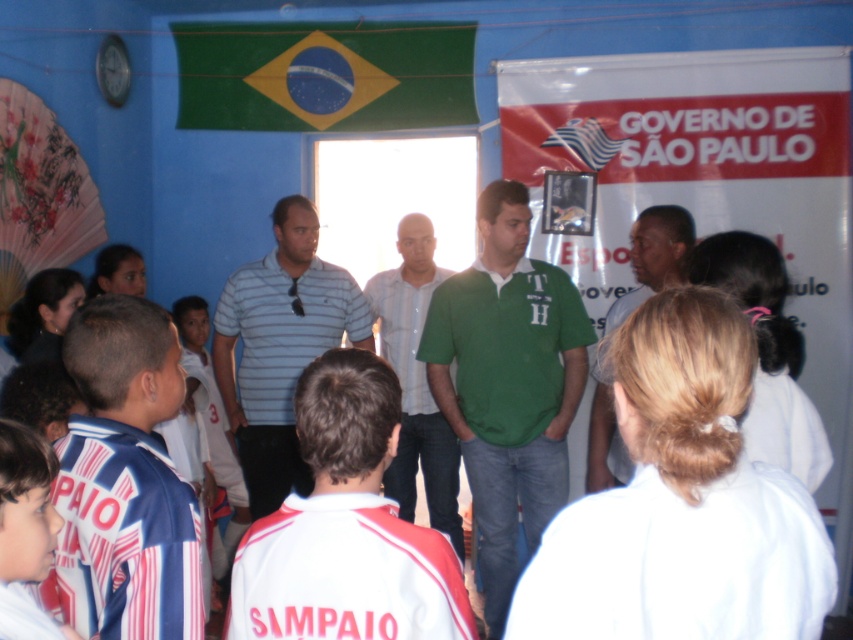
Question: Which point is closer to the camera taking this photo?

Choices:
 (A) (15, 456)
 (B) (743, 257)
 (C) (347, 444)

Answer: (A)

Question: Is the position of blonde hair at upper right less distant than that of light blue striped shirt at center?

Choices:
 (A) no
 (B) yes

Answer: (B)

Question: Which point is farther from the camera taking this photo?

Choices:
 (A) (320, 124)
 (B) (450, 426)

Answer: (A)

Question: Does light blue striped polo shirt at center appear over white glossy flag at upper center?

Choices:
 (A) yes
 (B) no

Answer: (B)

Question: Which of the following is the farthest from the observer?

Choices:
 (A) blue and white striped jersey at lower left
 (B) white cotton shirt at center

Answer: (B)

Question: Is white cotton shirt at center positioned before white glossy flag at upper center?

Choices:
 (A) yes
 (B) no

Answer: (B)